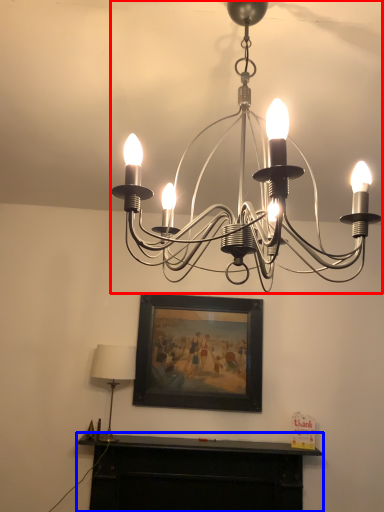
Question: Which object is further to the camera taking this photo, lamp (highlighted by a red box) or furniture (highlighted by a blue box)?

Choices:
 (A) lamp
 (B) furniture

Answer: (B)